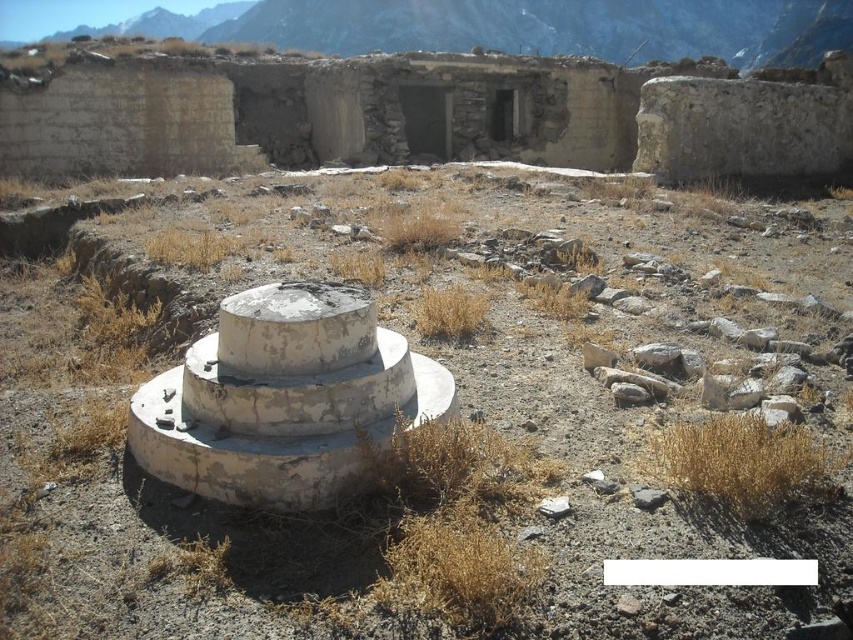
Which is more to the left, weathered concrete ruins at upper center or white weathered concrete structure at center?

Positioned to the left is white weathered concrete structure at center.

Who is more forward, (x=238, y=72) or (x=236, y=332)?

Point (x=236, y=332) is more forward.

The width and height of the screenshot is (853, 640). I want to click on weathered concrete ruins at upper center, so click(419, 115).

This screenshot has height=640, width=853. In order to click on weathered concrete ruins at upper center in this screenshot , I will do `click(419, 115)`.

Find the location of a particular element. Image resolution: width=853 pixels, height=640 pixels. weathered concrete ruins at upper center is located at coordinates (419, 115).

Between point (486, 54) and point (654, 35), which one is positioned in front?

Point (486, 54)

Image resolution: width=853 pixels, height=640 pixels. I want to click on weathered concrete ruins at upper center, so (419, 115).

Does gray stone mountain at upper center appear on the left side of weathered concrete cylinder at center?

Yes, gray stone mountain at upper center is to the left of weathered concrete cylinder at center.

Between point (761, 60) and point (320, 346), which one is positioned behind?

Positioned behind is point (761, 60).

What are the coordinates of `gray stone mountain at upper center` in the screenshot? It's located at (521, 28).